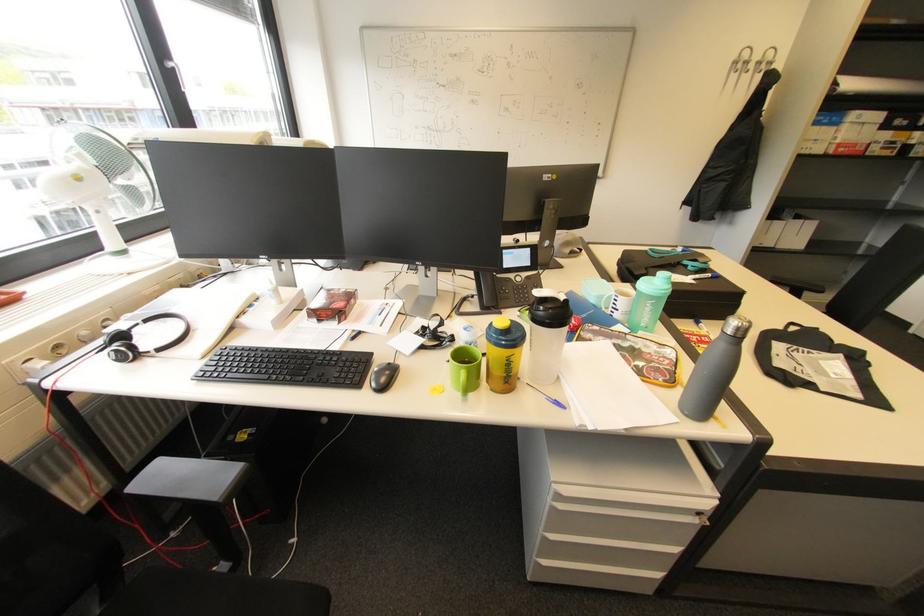
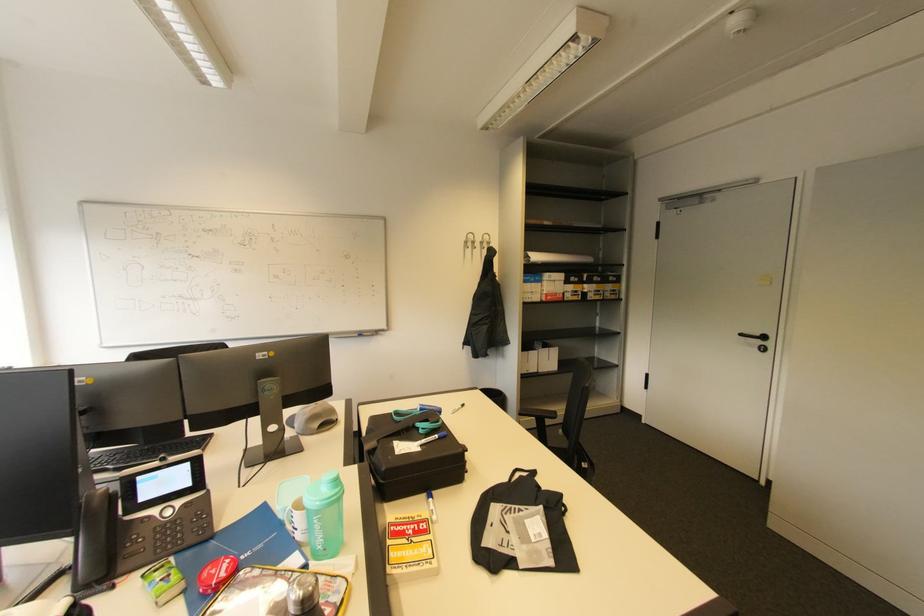
Locate, in the second image, the point that corresponds to pixel 764 63 in the first image.

(487, 244)